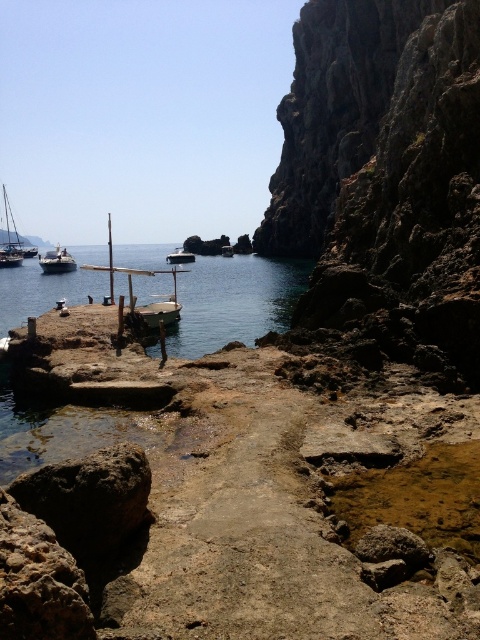
Question: Does rusty rock at lower left have a greater width compared to white glossy boat at center?

Choices:
 (A) no
 (B) yes

Answer: (A)

Question: Is white glossy boat at center smaller than wooden boat at center?

Choices:
 (A) yes
 (B) no

Answer: (B)

Question: Which of the following is the closest to the observer?

Choices:
 (A) (57, 266)
 (B) (189, 262)
 (C) (8, 216)
 (D) (228, 248)

Answer: (A)

Question: Estimate the real-world distances between objects in this image. Which object is closer to the clear blue water at center?

Choices:
 (A) metallic silver boat at left
 (B) wooden boat at center

Answer: (A)

Question: Is matte black sailboat at left positioned behind metallic silver boat at left?

Choices:
 (A) no
 (B) yes

Answer: (B)

Question: Which point appears closest to the camera in this image?

Choices:
 (A) (69, 260)
 (B) (115, 493)
 (C) (0, 310)

Answer: (B)